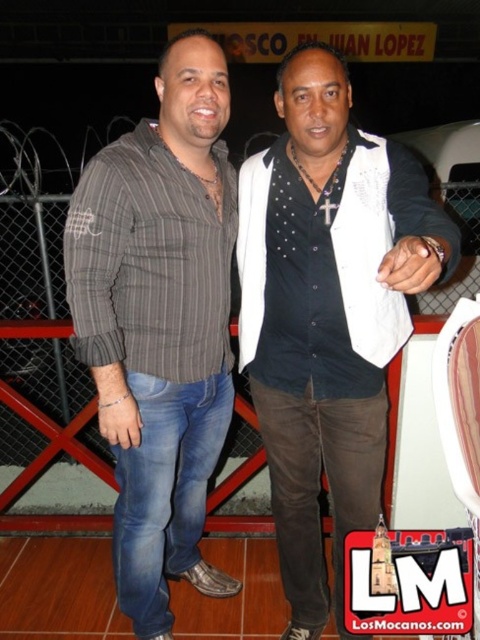
In the scene shown: You are a photographer adjusting your camera focus. You have two points in your viewfinder labeled as point (285, 564) and point (107, 196). If you focus on the closer point, which point should you choose?

Point (107, 196) is closer to the camera than point (285, 564), so you should choose point (107, 196) to focus on if you want the closer point in focus.

You are a photographer setting up a portrait shoot for two people. You have a backdrop that is 1.5 meters wide. Both individuals will stand side by side. Given their clothing items, the white textured vest at center and the gray striped shirt at center, which clothing item requires more space to accommodate its width?

The white textured vest at center requires more space because its width is larger than the gray striped shirt at center.